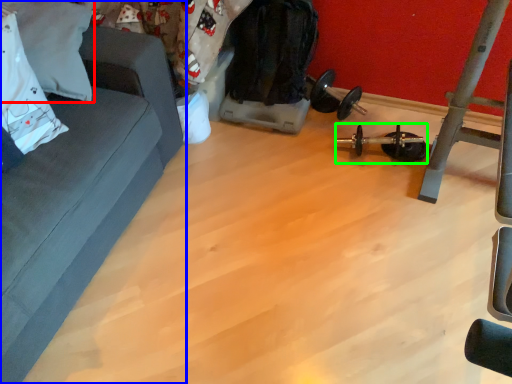
Question: Which object is positioned farthest from pillow (highlighted by a red box)? Select from studio couch (highlighted by a blue box) and equipment (highlighted by a green box).

Choices:
 (A) studio couch
 (B) equipment

Answer: (B)